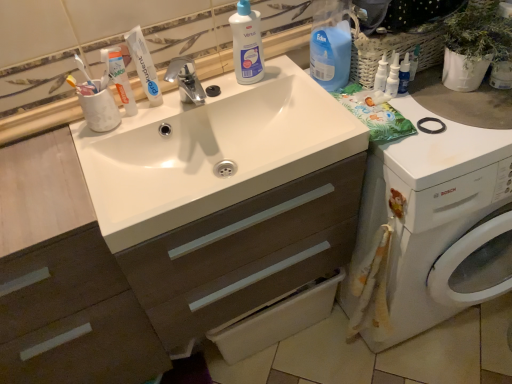
Identify the location of vacant space in front of white glossy toothpaste at upper left. (136, 134).